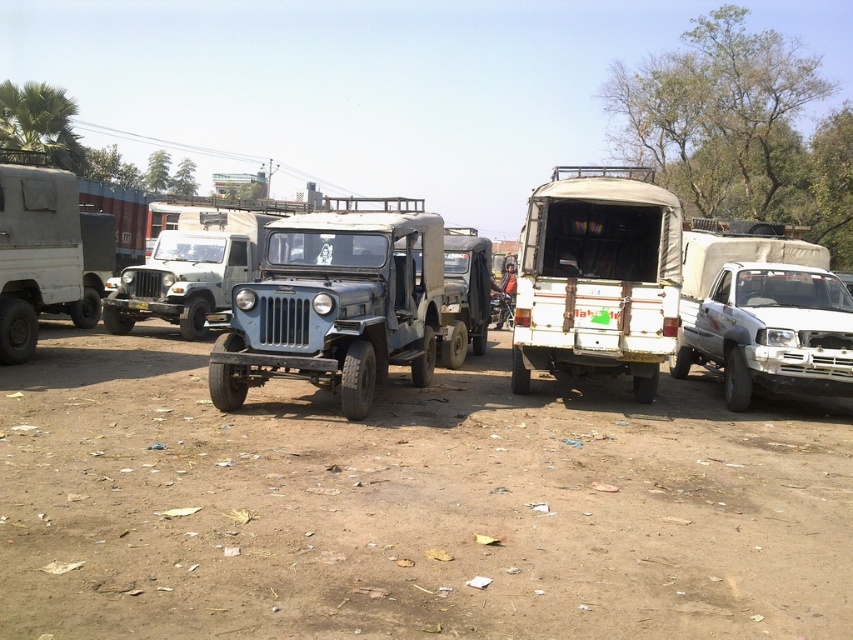
Can you confirm if dull brown dirt at center is smaller than blue matte jeep at center?

Actually, dull brown dirt at center might be larger than blue matte jeep at center.

Which is below, dull brown dirt at center or blue matte jeep at center?

dull brown dirt at center

Describe the element at coordinates (408, 506) in the screenshot. I see `dull brown dirt at center` at that location.

This screenshot has width=853, height=640. Find the location of `dull brown dirt at center`. dull brown dirt at center is located at coordinates (408, 506).

Between point (593, 288) and point (102, 232), which one is positioned in front?

Positioned in front is point (593, 288).

Can you confirm if white matte pickup truck at center is shorter than white matte truck at left?

No, white matte pickup truck at center is not shorter than white matte truck at left.

Identify the location of white matte pickup truck at center. The height and width of the screenshot is (640, 853). (598, 276).

Consider the image. Which of these two, white matte truck at right or white matte truck at left, stands taller?

With more height is white matte truck at right.

Between point (695, 348) and point (45, 284), which one is positioned behind?

Positioned behind is point (695, 348).

Identify the location of white matte truck at right. (769, 330).